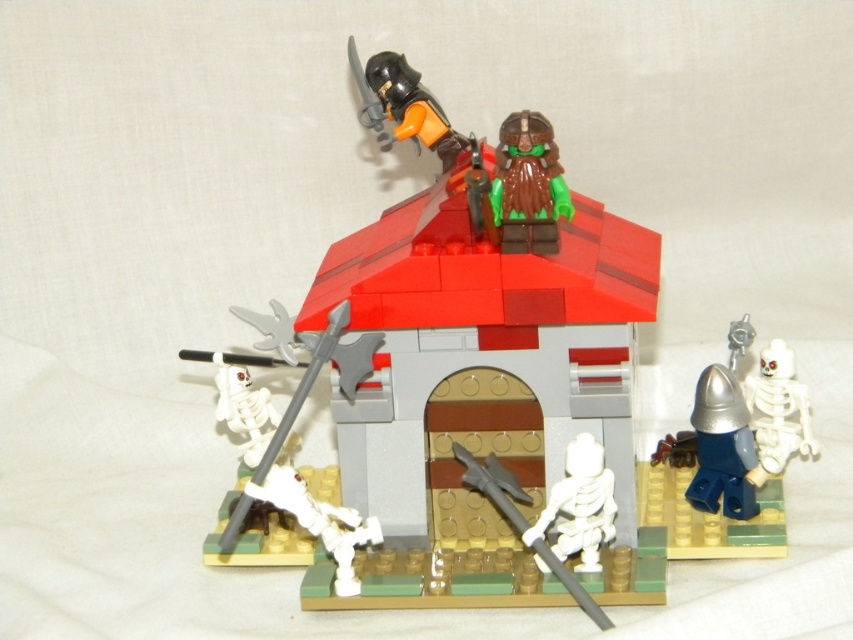
Question: Does matte black helmet at upper center have a larger size compared to metallic silver helmet at lower right?

Choices:
 (A) yes
 (B) no

Answer: (A)

Question: Among these points, which one is nearest to the camera?

Choices:
 (A) (779, 394)
 (B) (737, 484)

Answer: (B)

Question: Among these objects, which one is farthest from the camera?

Choices:
 (A) green matte helmeted figure at center
 (B) matte black helmet at upper center
 (C) white matte skeleton at right

Answer: (C)

Question: Can you confirm if green matte helmeted figure at center is positioned to the left of gray metallic spear at lower center?

Choices:
 (A) yes
 (B) no

Answer: (A)

Question: Can you confirm if green matte helmeted figure at center is thinner than metallic silver helmet at lower right?

Choices:
 (A) yes
 (B) no

Answer: (A)

Question: Which point is closer to the camera?

Choices:
 (A) (808, 412)
 (B) (712, 372)

Answer: (B)